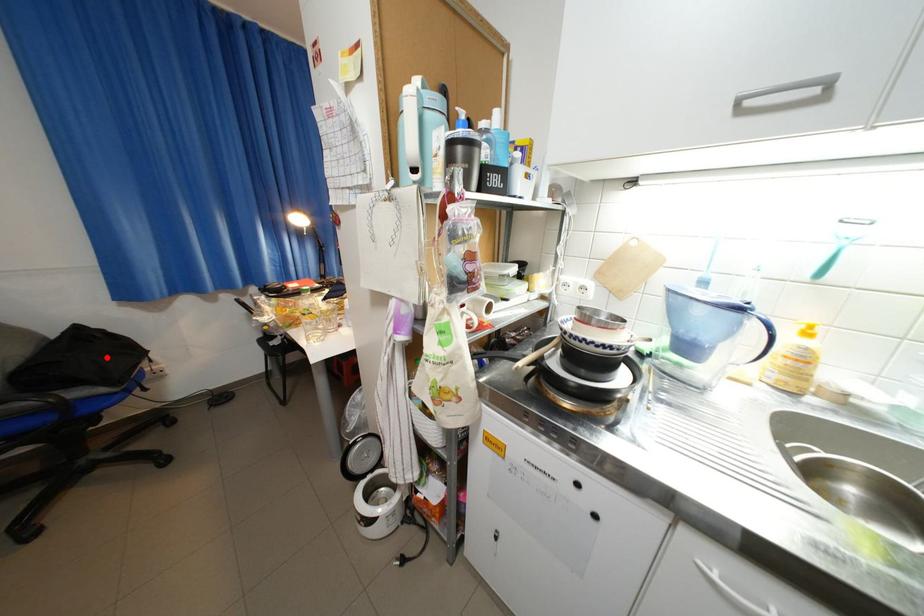
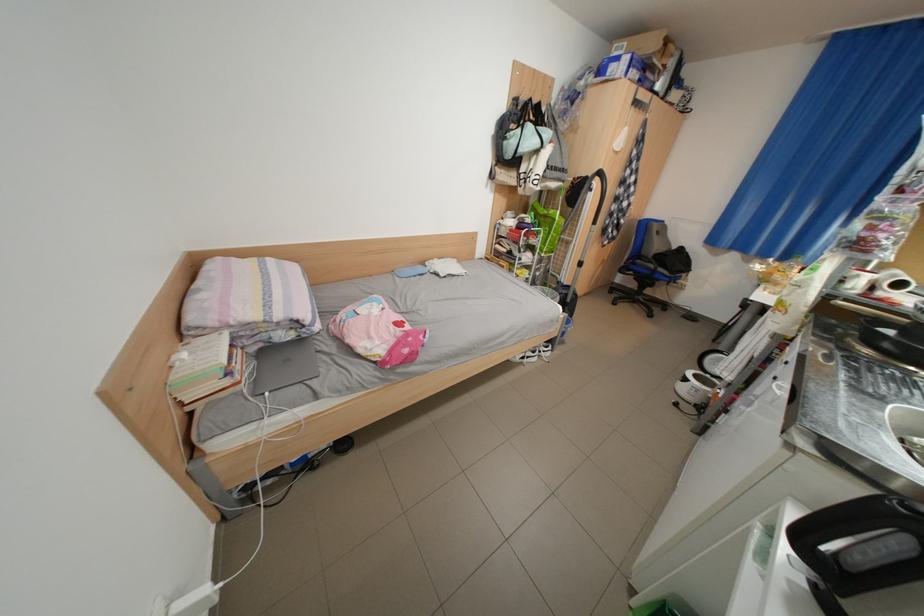
Question: I am providing you with two images of the same scene from different viewpoints. A red point is shown in image1. For the corresponding object point in image2, is it positioned nearer or farther from the camera?

Choices:
 (A) Nearer
 (B) Farther

Answer: (A)